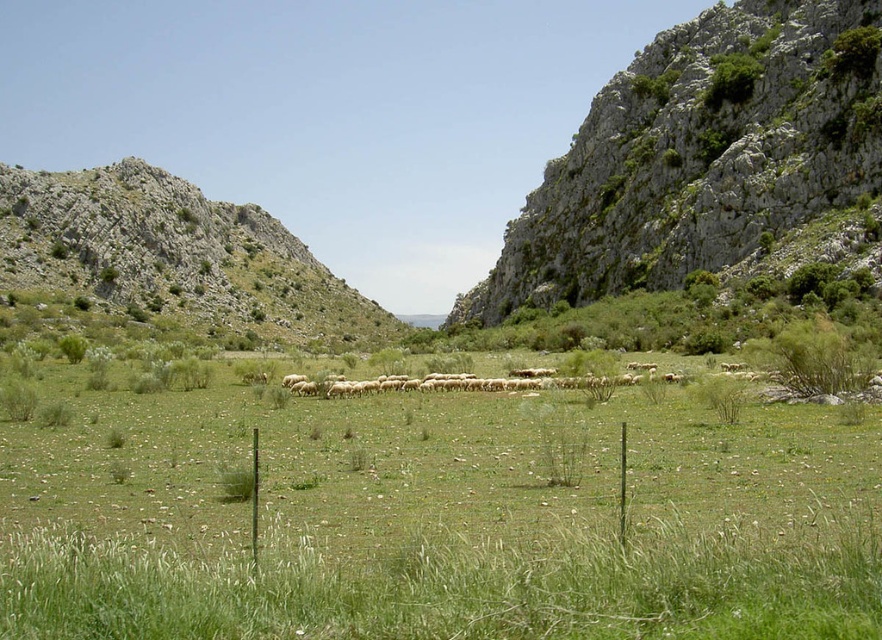
Question: Can you confirm if green rocky hillside at upper right is positioned above rugged stone hillside at left?

Choices:
 (A) yes
 (B) no

Answer: (A)

Question: Does green rocky hillside at upper right lie in front of rugged stone hillside at left?

Choices:
 (A) no
 (B) yes

Answer: (B)

Question: Among these objects, which one is nearest to the camera?

Choices:
 (A) rugged stone hillside at left
 (B) green rocky hillside at upper right

Answer: (B)

Question: Can you confirm if green rocky hillside at upper right is smaller than rugged stone hillside at left?

Choices:
 (A) yes
 (B) no

Answer: (A)